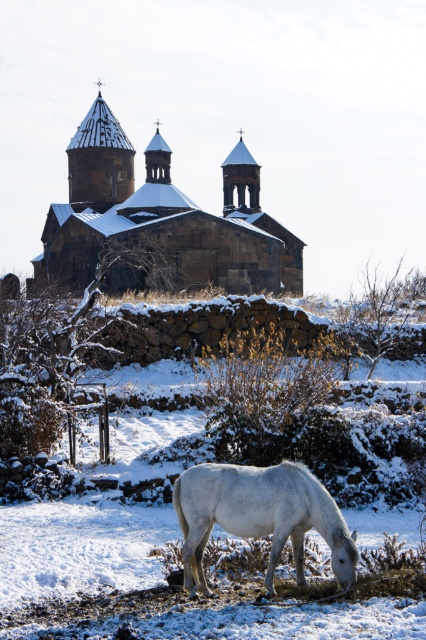
Question: Where is dark brown stone church at center located in relation to white matte horse at lower center in the image?

Choices:
 (A) above
 (B) below

Answer: (A)

Question: In this image, where is dark brown stone church at center located relative to white matte horse at lower center?

Choices:
 (A) below
 (B) above

Answer: (B)

Question: Can you confirm if dark brown stone church at center is thinner than white matte horse at lower center?

Choices:
 (A) yes
 (B) no

Answer: (B)

Question: Which object appears closest to the camera in this image?

Choices:
 (A) dark brown stone church at center
 (B) white matte horse at lower center

Answer: (B)